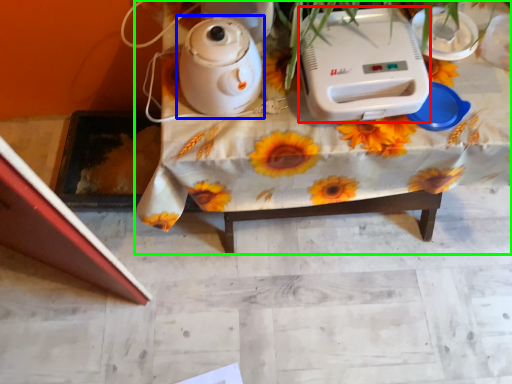
Question: Which object is the closest to the appliance (highlighted by a red box)? Choose among these: kettle (highlighted by a blue box) or table (highlighted by a green box).

Choices:
 (A) kettle
 (B) table

Answer: (B)